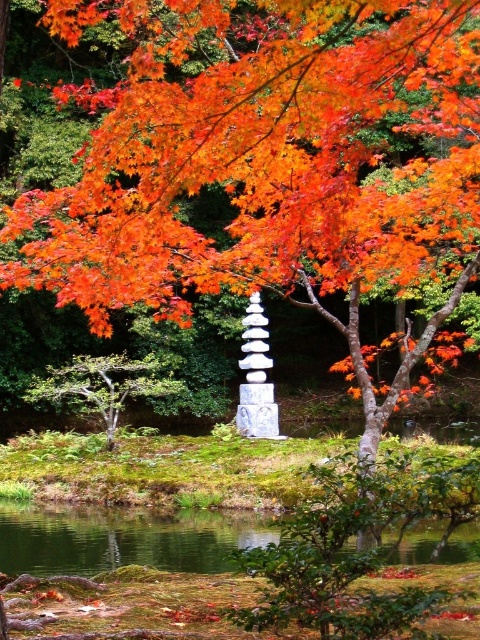
You are standing at the edge of the garden and see the point labeled as point (122, 538). What is the location of this point relative to the green reflective water at lower center?

The point (122, 538) is located on the green reflective water at lower center.